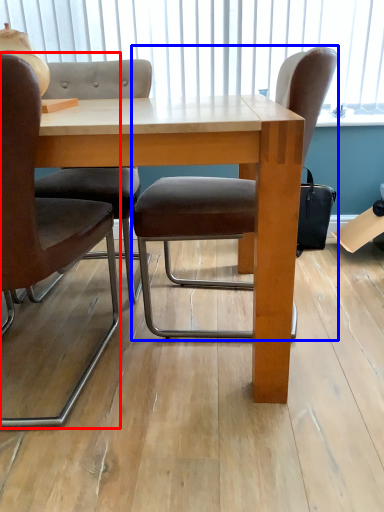
Question: Which of the following is the farthest to the observer, chair (highlighted by a red box) or chair (highlighted by a blue box)?

Choices:
 (A) chair
 (B) chair

Answer: (B)